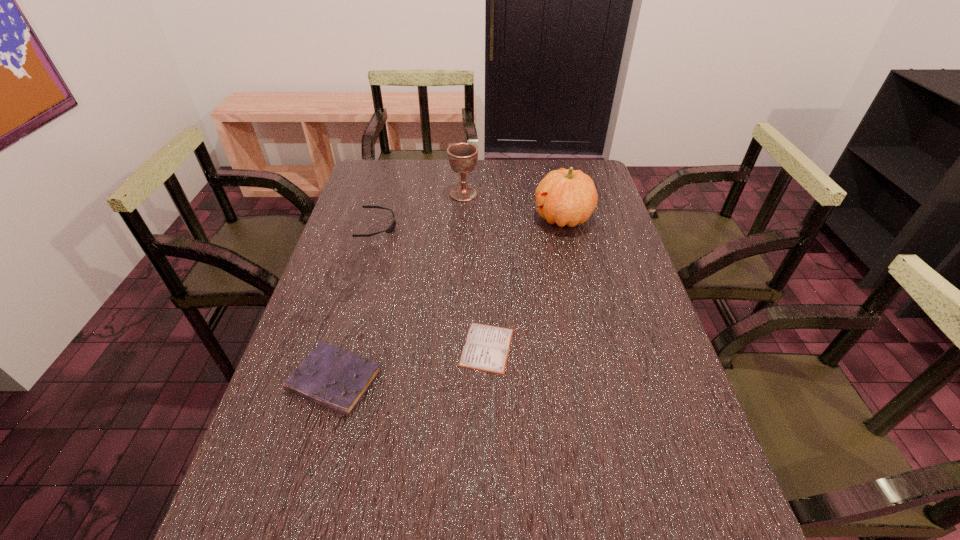
This screenshot has width=960, height=540. Find the location of `pumpkin`. pumpkin is located at coordinates (568, 197).

This screenshot has height=540, width=960. In order to click on the farthest object in this screenshot , I will do `click(462, 157)`.

Find the location of a particular element. The height and width of the screenshot is (540, 960). chalice is located at coordinates (462, 157).

The width and height of the screenshot is (960, 540). What are the coordinates of `sunglasses` in the screenshot? It's located at (390, 229).

The width and height of the screenshot is (960, 540). Identify the location of the taller diary. (329, 376).

Locate an element on the screen. The width and height of the screenshot is (960, 540). the right diary is located at coordinates click(486, 348).

This screenshot has height=540, width=960. Find the location of `the shortest object`. the shortest object is located at coordinates (486, 348).

What are the coordinates of `vacant region located 0.350m on the carved face of the rightmost object` in the screenshot? It's located at (431, 218).

The width and height of the screenshot is (960, 540). I want to click on vacant space located 0.220m on the carved face of the rightmost object, so [469, 218].

Locate an element on the screen. vacant region located on the carved face of the rightmost object is located at coordinates (445, 218).